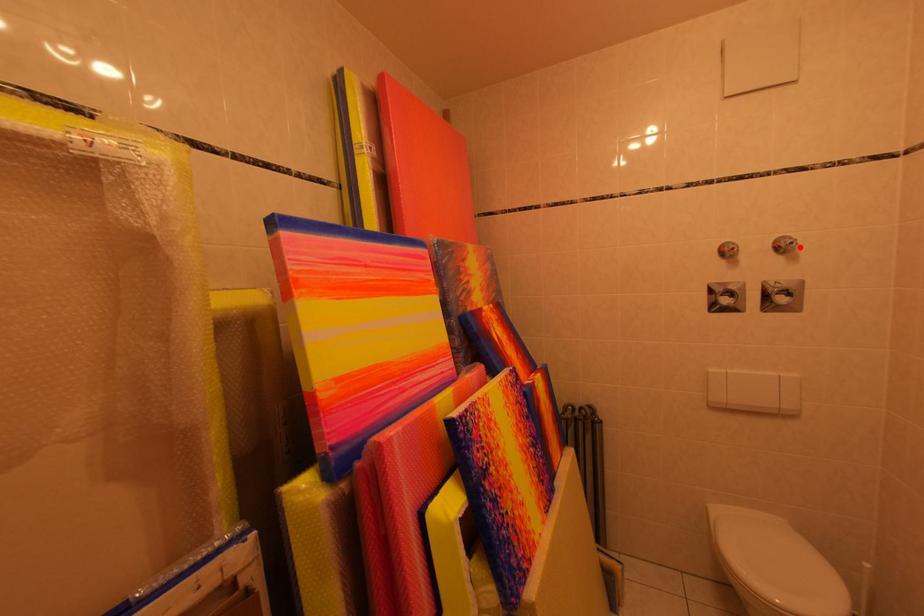
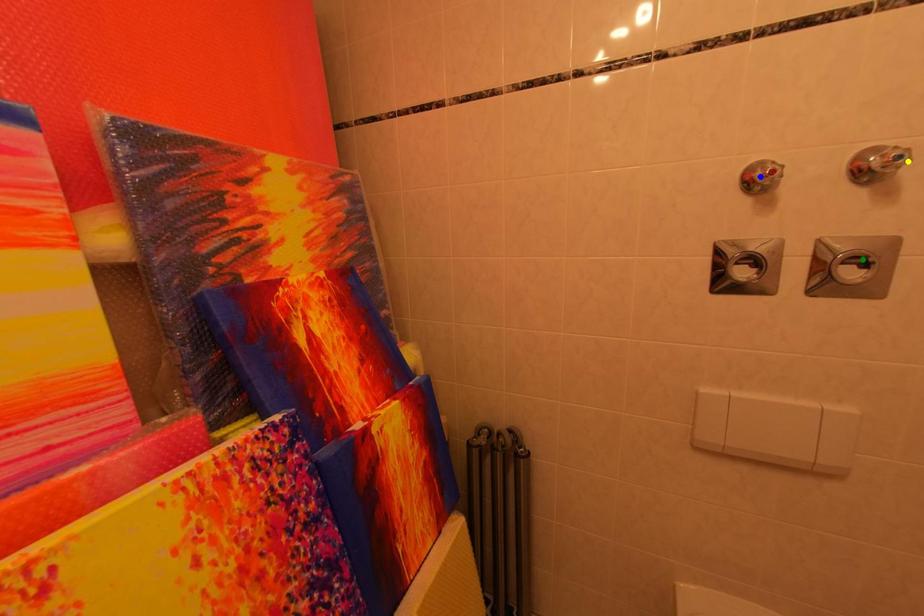
Question: I am providing you with two images of the same scene from different viewpoints. A red point is marked on the first image. You are given multiple points on the second image. Which point in image 2 represents the same 3d spot as the red point in image 1?

Choices:
 (A) yellow point
 (B) green point
 (C) blue point

Answer: (A)